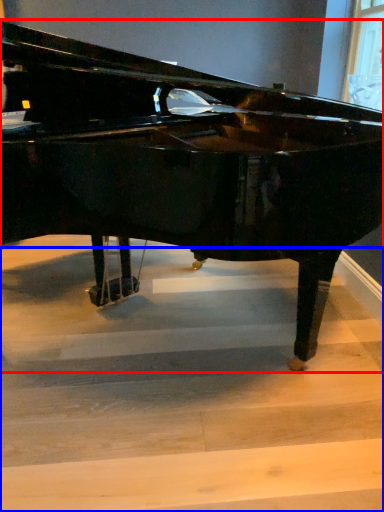
Question: Which point is closer to the camera, piano (highlighted by a red box) or stairwell (highlighted by a blue box)?

Choices:
 (A) piano
 (B) stairwell

Answer: (A)